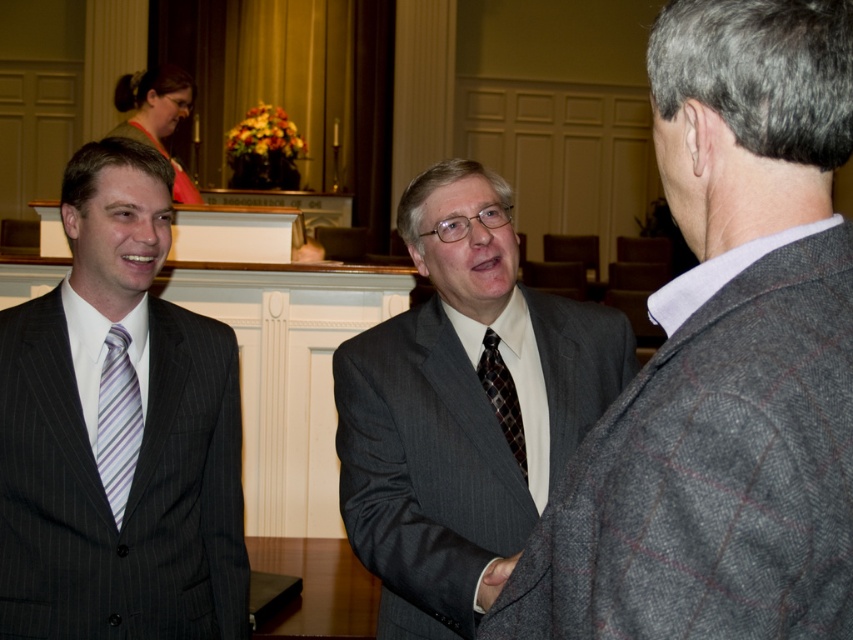
Which is behind, point (100, 490) or point (488, 401)?

Positioned behind is point (488, 401).

Between point (50, 627) and point (387, 577), which one is positioned behind?

Positioned behind is point (50, 627).

Locate an element on the screen. pinstriped suit at left is located at coordinates (119, 435).

Does pinstriped suit at left have a greater height compared to dark brown textured tie at center?

Yes, pinstriped suit at left is taller than dark brown textured tie at center.

Which is in front, point (165, 452) or point (476, 369)?

Point (165, 452) is more forward.

Find the location of a particular element. Image resolution: width=853 pixels, height=640 pixels. pinstriped suit at left is located at coordinates (119, 435).

Find the location of a particular element. Image resolution: width=853 pixels, height=640 pixels. pinstriped suit at left is located at coordinates point(119,435).

Can you confirm if gray textured blazer at center is wider than pinstriped suit at left?

Incorrect, gray textured blazer at center's width does not surpass pinstriped suit at left's.

Is gray textured blazer at center positioned in front of pinstriped suit at left?

Yes, it is.

Between point (712, 93) and point (97, 209), which one is positioned in front?

Point (712, 93) is more forward.

What are the coordinates of `gray textured blazer at center` in the screenshot? It's located at (724, 364).